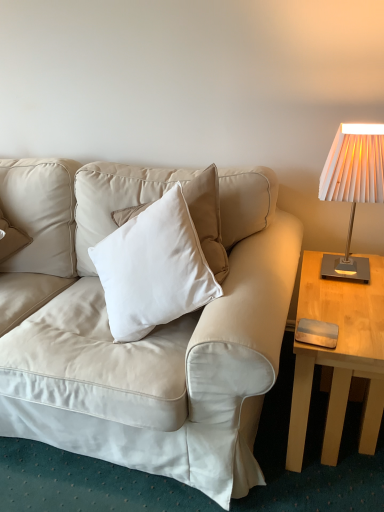
I want to click on vacant area on top of white pleated fabric lampshade at right (from a real-world perspective), so click(361, 127).